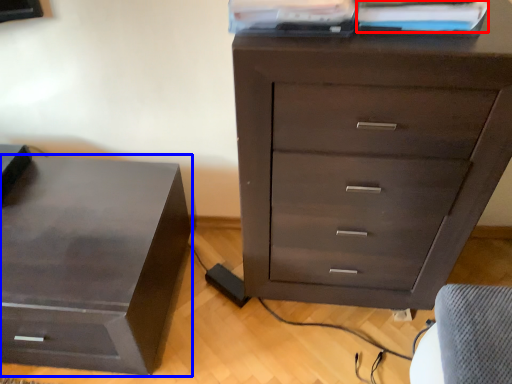
Question: Which of the following is the farthest to the observer, book (highlighted by a red box) or nightstand (highlighted by a blue box)?

Choices:
 (A) book
 (B) nightstand

Answer: (B)